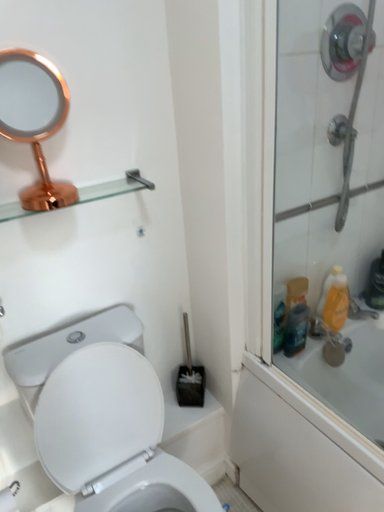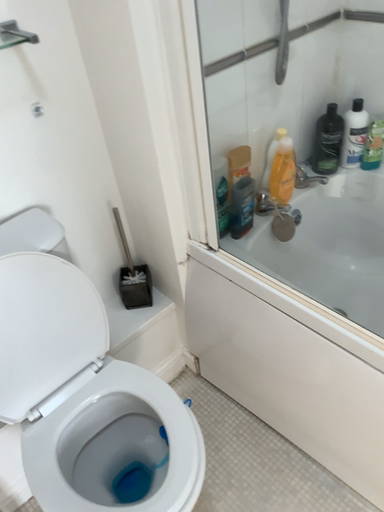
Question: Which way did the camera rotate in the video?

Choices:
 (A) rotated downward
 (B) rotated upward

Answer: (A)